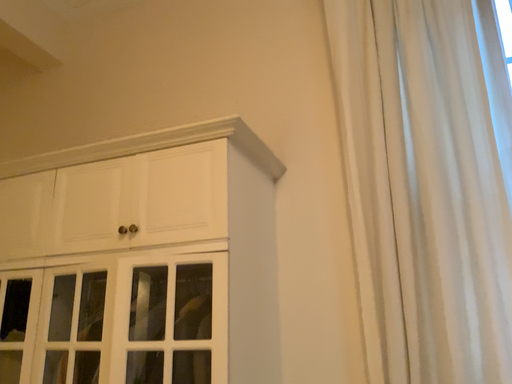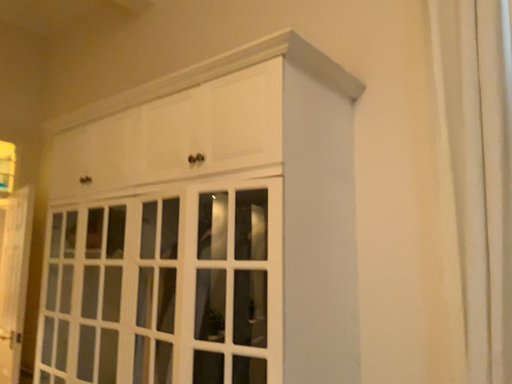
Question: Which way did the camera rotate in the video?

Choices:
 (A) rotated upward
 (B) rotated downward

Answer: (B)